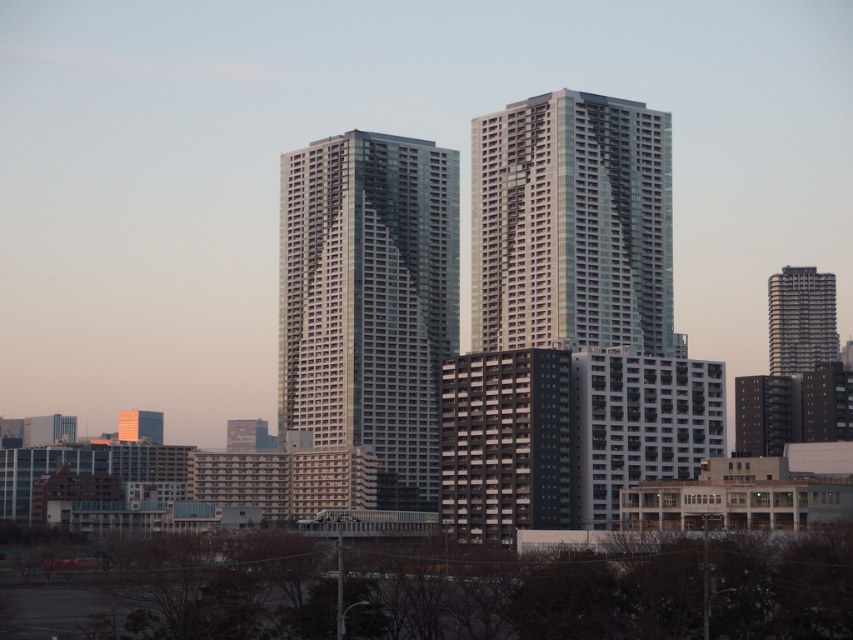
Based on the scene description, which building is larger in size between the glossy glass building at center and the metallic silver building at right?

The metallic silver building at right is larger than the glossy glass building at center.

You are standing in the city square looking at the glassy metallic building at center and the orange glass tower at lower left. Which building appears nearer to you?

The glassy metallic building at center is closer to the viewer than the orange glass tower at lower left, so it appears nearer.